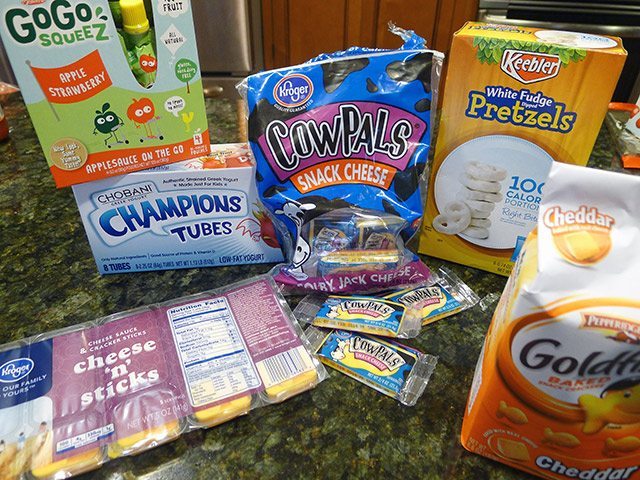
I want to click on cabinet door, so click(x=312, y=9), click(x=413, y=8).